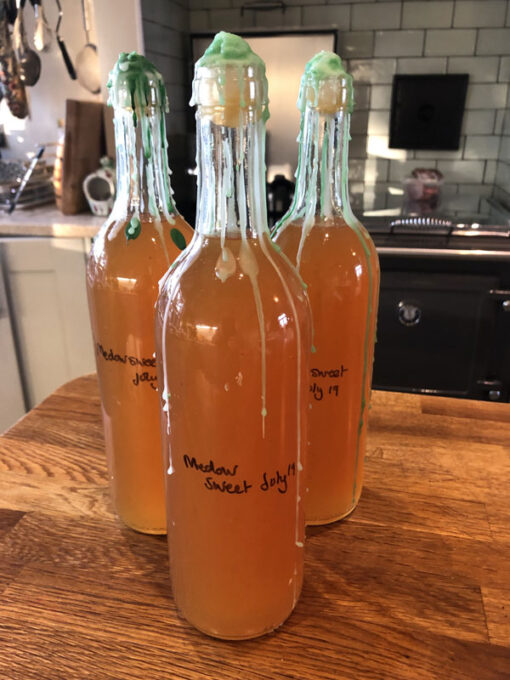
What are the coordinates of `corks inside the necks of the bottles` in the screenshot? It's located at (234, 90), (330, 97), (138, 103).